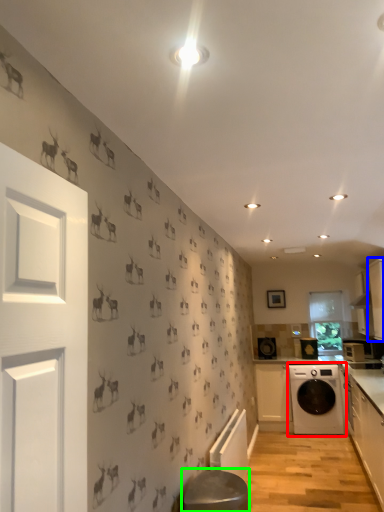
Question: Considering the real-world distances, which object is closest to washing machine (highlighted by a red box)? cabinetry (highlighted by a blue box) or bar stool (highlighted by a green box).

Choices:
 (A) cabinetry
 (B) bar stool

Answer: (A)